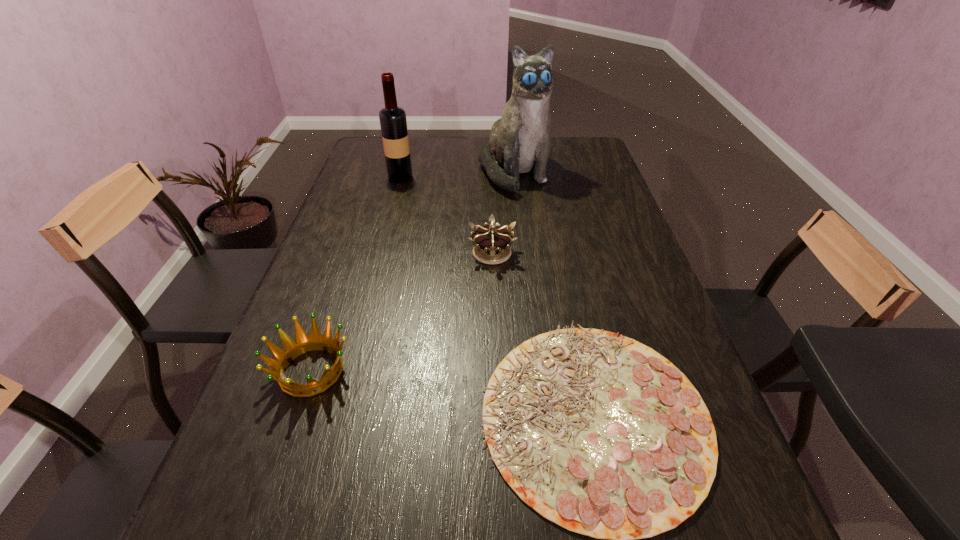
Where is `empty space that is in between the nearer crown and the wine bottle`? The image size is (960, 540). empty space that is in between the nearer crown and the wine bottle is located at coordinates pos(356,274).

Find the location of a particular element. free spot between the cat and the third farthest object is located at coordinates (503, 213).

Find the location of a particular element. The image size is (960, 540). vacant space in between the cat and the fourth shortest object is located at coordinates (457, 175).

You are a GUI agent. You are given a task and a screenshot of the screen. Output one action in this format:
    pyautogui.click(x=<x>, y=<y>)
    Task: Click on the vacant area that lies between the cat and the wine bottle
    The height and width of the screenshot is (540, 960).
    Given the screenshot: What is the action you would take?
    pyautogui.click(x=457, y=175)

Identify which object is located as the nearest to the nearer crown. Please provide its 2D coordinates. Your answer should be formatted as a tuple, i.e. [(x, y)], where the tuple contains the x and y coordinates of a point satisfying the conditions above.

[(597, 432)]

Where is `the closest object to the third farthest object`? The width and height of the screenshot is (960, 540). the closest object to the third farthest object is located at coordinates (597, 432).

You are a GUI agent. You are given a task and a screenshot of the screen. Output one action in this format:
    pyautogui.click(x=<x>, y=<y>)
    Task: Click on the vacant space that satisfies the following two spatial constraints: 1. on the front side of the right crown; 2. on the left side of the wine bottle
    
    Given the screenshot: What is the action you would take?
    pyautogui.click(x=380, y=253)